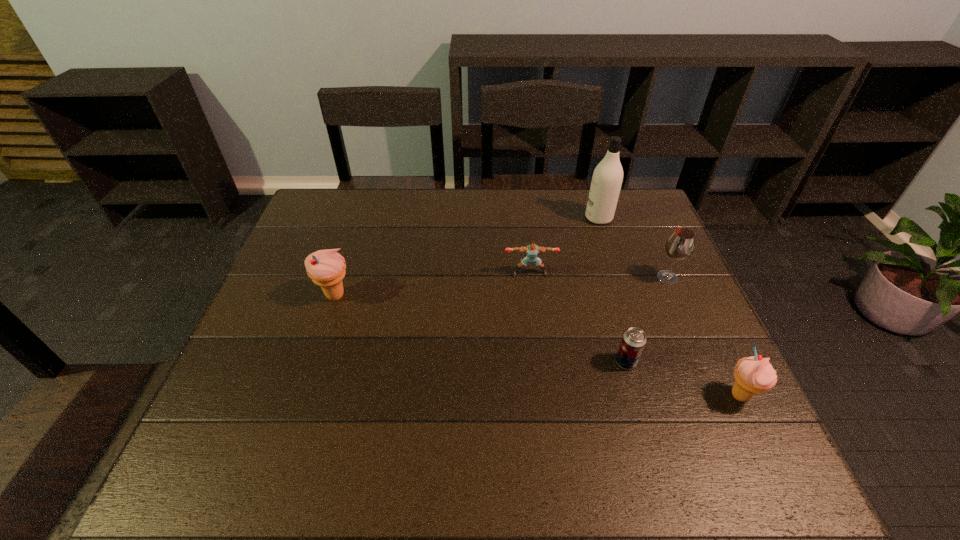
You are a GUI agent. You are given a task and a screenshot of the screen. Output one action in this format:
    pyautogui.click(x=<x>, y=<y>)
    Task: Click on the vacant space located on the back of the right icecream
    This screenshot has height=540, width=960.
    Given the screenshot: What is the action you would take?
    click(x=696, y=304)

I want to click on free region located on the front-facing side of the fifth object from right to left, so click(x=533, y=295).

Image resolution: width=960 pixels, height=540 pixels. Find the location of `vacant space situated on the front of the wineglass`. vacant space situated on the front of the wineglass is located at coordinates (682, 308).

I want to click on vacant space located 0.380m on the front-facing side of the farthest object, so click(467, 218).

At what (x,y) coordinates should I click in order to perform the action: click on vacant space located on the front-facing side of the farthest object. Please return your answer as a coordinate pair (x, y). Looking at the image, I should click on (538, 218).

You are a GUI agent. You are given a task and a screenshot of the screen. Output one action in this format:
    pyautogui.click(x=<x>, y=<y>)
    Task: Click on the free space located on the front-facing side of the farthest object
    
    Given the screenshot: What is the action you would take?
    pyautogui.click(x=463, y=218)

Locate an element on the screen. vacant space positioned on the left of the beer can is located at coordinates (442, 362).

The image size is (960, 540). In order to click on object positioned at the far edge in this screenshot , I will do `click(607, 178)`.

Where is `object located at the near edge`? This screenshot has height=540, width=960. object located at the near edge is located at coordinates (754, 374).

At what (x,y) coordinates should I click in order to perform the action: click on object located in the left edge section of the desktop. Please return your answer as a coordinate pair (x, y). This screenshot has height=540, width=960. Looking at the image, I should click on (326, 268).